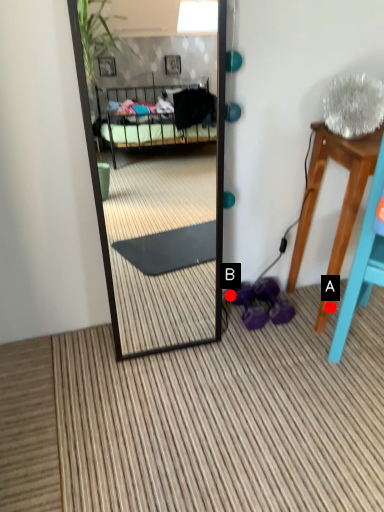
Question: Two points are circled on the image, labeled by A and B beside each circle. Which point is farther from the camera taking this photo?

Choices:
 (A) A is further
 (B) B is further

Answer: (A)